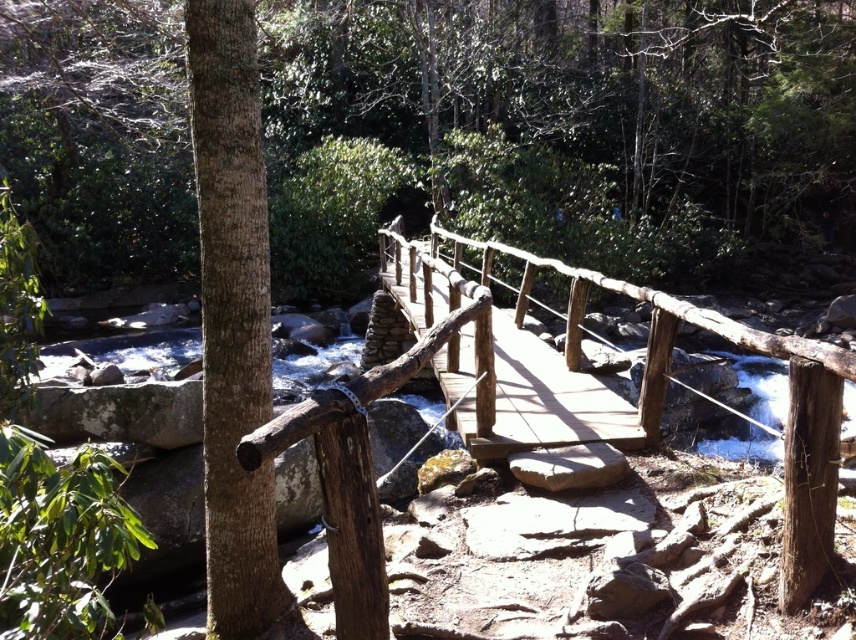
Between smooth brown tree trunk at left and brown rough wooden post at lower right, which one is positioned lower?

Positioned lower is brown rough wooden post at lower right.

Who is shorter, smooth brown tree trunk at left or brown rough wooden post at lower right?

Standing shorter between the two is brown rough wooden post at lower right.

Consider the image. Who is more forward, (210, 179) or (788, 568)?

Point (788, 568) is more forward.

Locate an element on the screen. This screenshot has height=640, width=856. smooth brown tree trunk at left is located at coordinates (233, 321).

Does natural wood bridge at center have a lesser height compared to brown rough wooden post at lower right?

In fact, natural wood bridge at center may be taller than brown rough wooden post at lower right.

Is natural wood bridge at center to the right of brown rough wooden post at lower right from the viewer's perspective?

No, natural wood bridge at center is not to the right of brown rough wooden post at lower right.

Image resolution: width=856 pixels, height=640 pixels. What do you see at coordinates (599, 380) in the screenshot? I see `natural wood bridge at center` at bounding box center [599, 380].

The width and height of the screenshot is (856, 640). In order to click on natural wood bridge at center in this screenshot , I will do `click(599, 380)`.

Between smooth brown tree trunk at left and natural wood bridge at center, which one is positioned lower?

Positioned lower is smooth brown tree trunk at left.

Is point (263, 417) more distant than point (768, 355)?

Yes, point (263, 417) is farther from viewer.

I want to click on smooth brown tree trunk at left, so click(233, 321).